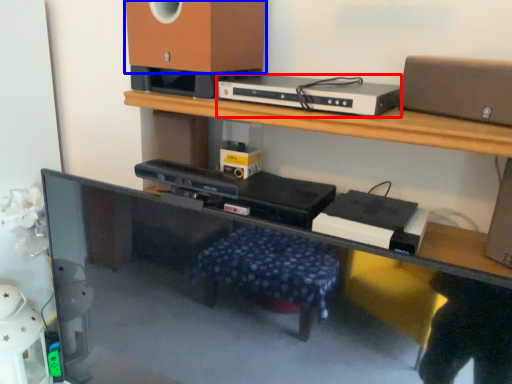
Question: Which object appears farthest to the camera in this image, gadget (highlighted by a red box) or speaker (highlighted by a blue box)?

Choices:
 (A) gadget
 (B) speaker

Answer: (B)